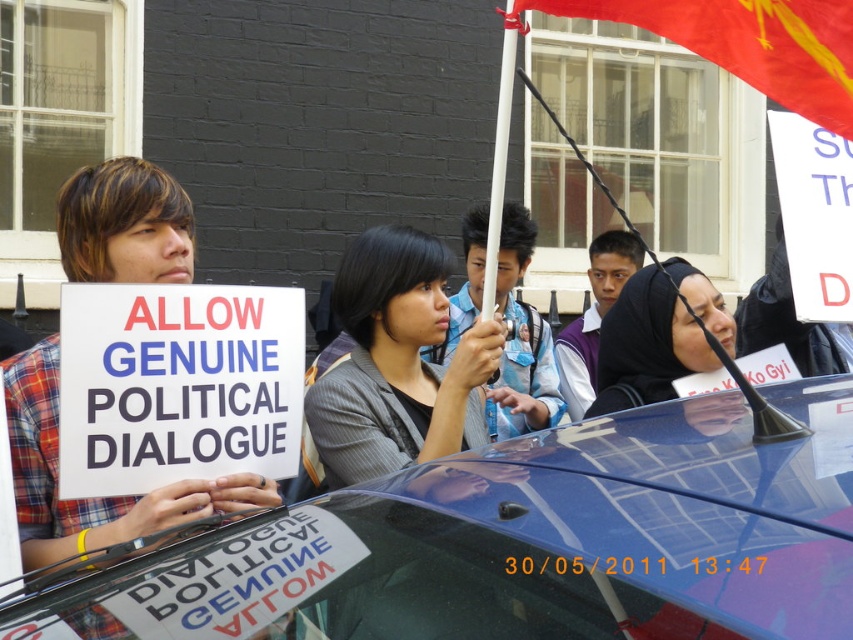
Between gray textured blazer at center and red fabric flag at upper right, which one appears on the left side from the viewer's perspective?

From the viewer's perspective, gray textured blazer at center appears more on the left side.

Measure the distance between gray textured blazer at center and camera.

gray textured blazer at center is 8.65 feet away from camera.

You are a GUI agent. You are given a task and a screenshot of the screen. Output one action in this format:
    pyautogui.click(x=<x>, y=<y>)
    Task: Click on the gray textured blazer at center
    
    Given the screenshot: What is the action you would take?
    pyautogui.click(x=396, y=362)

Is shiny blue car at center smaller than gray textured blazer at center?

No.

Who is more distant from viewer, (432,468) or (444,381)?

Point (444,381)

At what (x,y) coordinates should I click in order to perform the action: click on shiny blue car at center. Please return your answer as a coordinate pair (x, y). This screenshot has height=640, width=853. Looking at the image, I should click on (526, 544).

Is shiny blue car at center above red fabric flag at upper right?

Actually, shiny blue car at center is below red fabric flag at upper right.

Is shiny blue car at center to the right of red fabric flag at upper right from the viewer's perspective?

In fact, shiny blue car at center is to the left of red fabric flag at upper right.

The image size is (853, 640). Find the location of `shiny blue car at center`. shiny blue car at center is located at coordinates (526, 544).